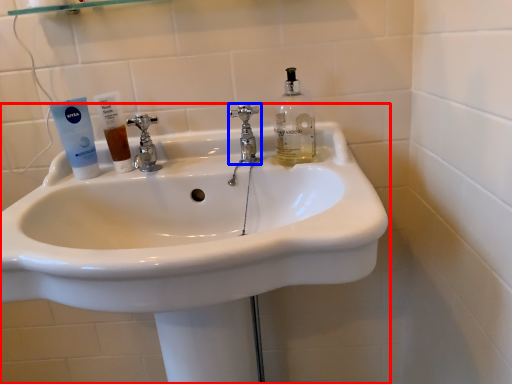
Question: Which object is closer to the camera taking this photo, sink (highlighted by a red box) or tap (highlighted by a blue box)?

Choices:
 (A) sink
 (B) tap

Answer: (A)